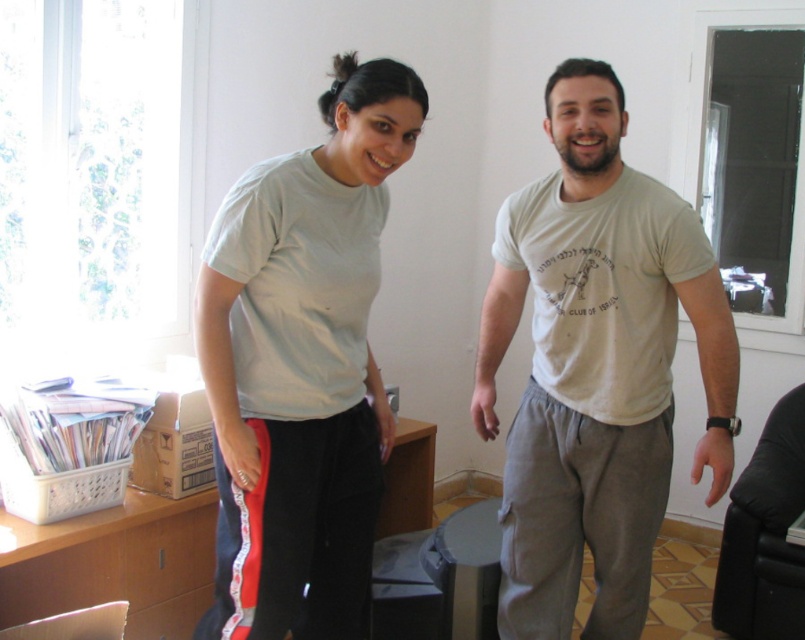
Between light gray cotton t-shirt at center and white cotton t-shirt at center, which one appears on the right side from the viewer's perspective?

white cotton t-shirt at center is more to the right.

Who is taller, light gray cotton t-shirt at center or white cotton t-shirt at center?

white cotton t-shirt at center

Find the location of a particular element. This screenshot has height=640, width=805. light gray cotton t-shirt at center is located at coordinates (597, 368).

Where is `light gray cotton t-shirt at center`? light gray cotton t-shirt at center is located at coordinates (597, 368).

In the scene shown: Is light gray cotton t-shirt at center bigger than light gray t-shirt at center?

Yes.

Which is behind, point (729, 454) or point (312, 198)?

Positioned behind is point (729, 454).

Which is in front, point (708, 259) or point (339, 449)?

Point (339, 449) is in front.

At what (x,y) coordinates should I click in order to perform the action: click on light gray cotton t-shirt at center. Please return your answer as a coordinate pair (x, y). The image size is (805, 640). Looking at the image, I should click on (597, 368).

Who is positioned more to the left, white cotton t-shirt at center or light gray t-shirt at center?

Positioned to the left is light gray t-shirt at center.

Can you confirm if white cotton t-shirt at center is wider than light gray t-shirt at center?

Indeed, white cotton t-shirt at center has a greater width compared to light gray t-shirt at center.

I want to click on white cotton t-shirt at center, so [x=597, y=368].